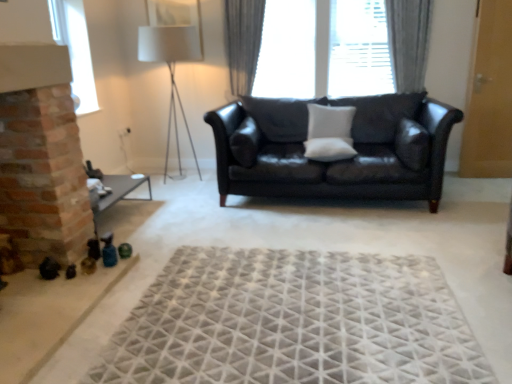
Question: Considering the relative sizes of white matte pillow at center, arranged as the third pillow when viewed from the right, and shiny black leather couch at center in the image provided, is white matte pillow at center, arranged as the third pillow when viewed from the right, smaller than shiny black leather couch at center?

Choices:
 (A) no
 (B) yes

Answer: (B)

Question: Is white matte pillow at center, arranged as the third pillow when viewed from the right, oriented away from shiny black leather couch at center?

Choices:
 (A) no
 (B) yes

Answer: (B)

Question: Does white matte pillow at center, arranged as the third pillow when viewed from the right, appear on the right side of shiny black leather couch at center?

Choices:
 (A) no
 (B) yes

Answer: (A)

Question: Is white matte pillow at center, the 1th pillow in the left-to-right sequence, wider than shiny black leather couch at center?

Choices:
 (A) yes
 (B) no

Answer: (B)

Question: Is white matte pillow at center, arranged as the third pillow when viewed from the right, closer to the viewer compared to shiny black leather couch at center?

Choices:
 (A) yes
 (B) no

Answer: (B)

Question: From their relative heights in the image, would you say white matte pillow at center, arranged as the third pillow when viewed from the right, is taller or shorter than clear glass window at upper left, arranged as the second window when viewed from the back?

Choices:
 (A) short
 (B) tall

Answer: (A)

Question: Is white matte pillow at center, the 1th pillow in the left-to-right sequence, in front of or behind clear glass window at upper left, which appears as the first window when viewed from the front, in the image?

Choices:
 (A) behind
 (B) front

Answer: (B)

Question: Is point (323, 137) closer or farther from the camera than point (50, 0)?

Choices:
 (A) farther
 (B) closer

Answer: (A)

Question: From the image's perspective, is white matte pillow at center, arranged as the third pillow when viewed from the right, located above or below clear glass window at upper left, which is the first window in left-to-right order?

Choices:
 (A) below
 (B) above

Answer: (A)

Question: Looking at the image, does gray fabric curtain at upper center, arranged as the 1th curtain when viewed from the right, seem bigger or smaller compared to white matte pillow at center, positioned as the second pillow in right-to-left order?

Choices:
 (A) big
 (B) small

Answer: (A)

Question: Is point (399, 77) positioned closer to the camera than point (309, 127)?

Choices:
 (A) closer
 (B) farther

Answer: (B)

Question: Would you say gray fabric curtain at upper center, arranged as the 1th curtain when viewed from the right, is to the left or to the right of white matte pillow at center, which is the second pillow from left to right, in the picture?

Choices:
 (A) right
 (B) left

Answer: (A)

Question: From the image's perspective, is gray fabric curtain at upper center, the second curtain in the left-to-right sequence, located above or below white matte pillow at center, positioned as the second pillow in right-to-left order?

Choices:
 (A) above
 (B) below

Answer: (A)

Question: Is white fabric lampshade at upper center in front of or behind white matte pillow at center, arranged as the third pillow when viewed from the right, in the image?

Choices:
 (A) behind
 (B) front

Answer: (A)

Question: From a real-world perspective, relative to white matte pillow at center, arranged as the third pillow when viewed from the right, is white fabric lampshade at upper center vertically above or below?

Choices:
 (A) above
 (B) below

Answer: (A)